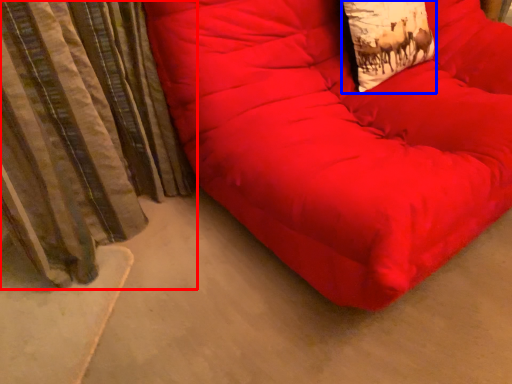
Question: Which object is further to the camera taking this photo, curtain (highlighted by a red box) or throw pillow (highlighted by a blue box)?

Choices:
 (A) curtain
 (B) throw pillow

Answer: (B)